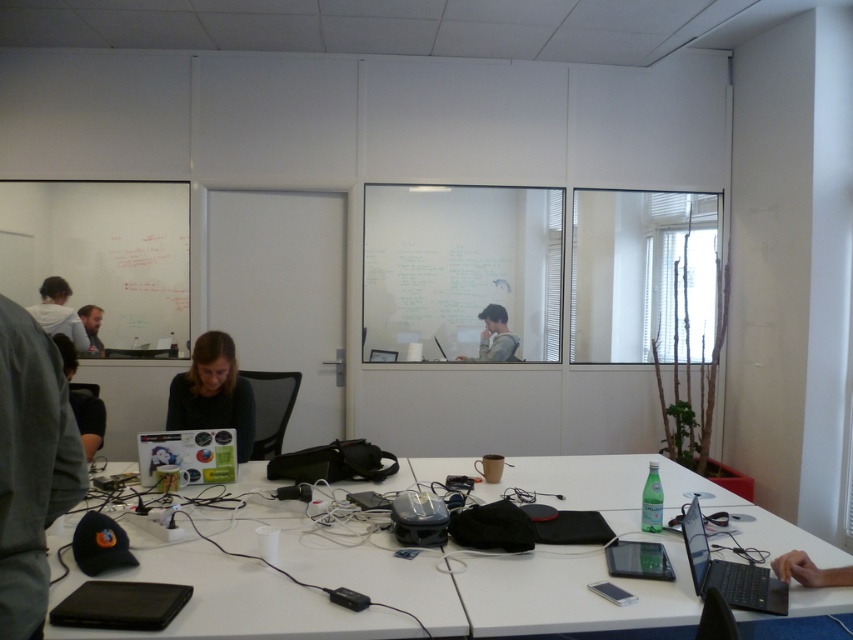
Looking at this image, in the modern office scene, there are several items on the long white table. Which object is located at the coordinates point (x=213, y=392)?

The point (x=213, y=392) indicates the location of the matte black laptop at lower left.

You are standing at the entrance of the office and see the point marked at coordinates (213, 392). Which object is this point located on?

The point marked at coordinates (213, 392) is located on the matte black laptop at lower left.

Based on the photo, you need to place a 12 inch wide tablet on the table. The matte black laptop at lower left and the white matte shirt at upper left are already there. Which object should you move to make space?

The matte black laptop at lower left has a larger width than the white matte shirt at upper left, so you should move the matte black laptop at lower left to make more space for the tablet.